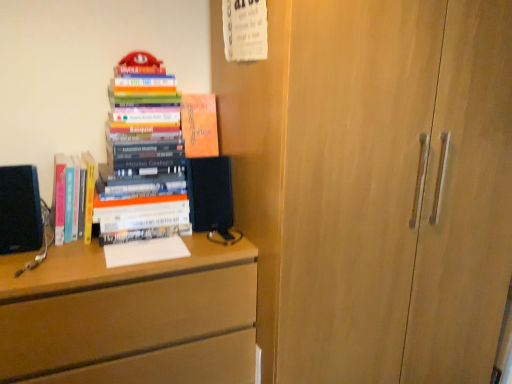
Where is `free point above matte wood chest of drawers at left (from a real-world perspective)`? free point above matte wood chest of drawers at left (from a real-world perspective) is located at coordinates (92, 247).